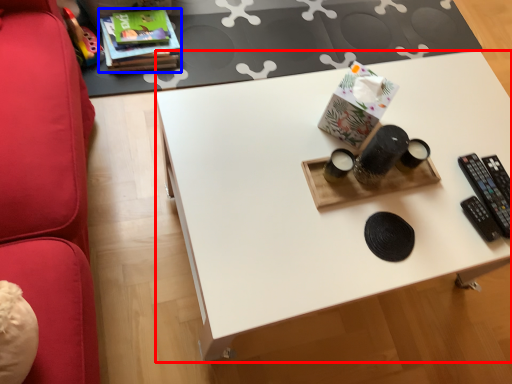
Question: Which object appears closest to the camera in this image, desk (highlighted by a red box) or book (highlighted by a blue box)?

Choices:
 (A) desk
 (B) book

Answer: (A)